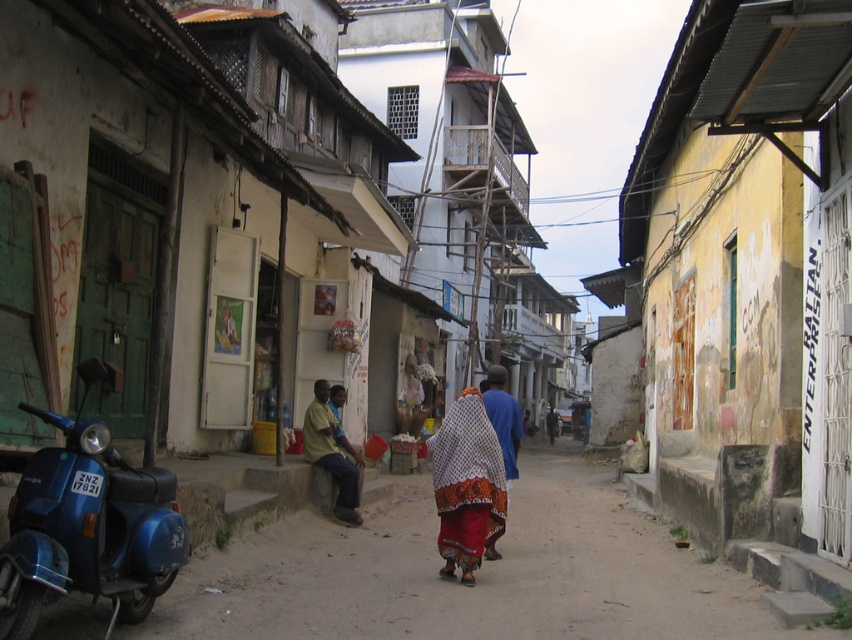
You are a delivery person trying to park your metallic blue scooter at left near the curb. However, there is a white printed fabric at center in the way. Can you park your scooter there without moving the fabric?

The metallic blue scooter at left is already positioned over the white printed fabric at center, so you cannot park there without moving the fabric.

You are a delivery person trying to park your metallic blue scooter at left near the curb. There is a white printed fabric at center hanging from a clothesline between two buildings. Can your scooter fit without touching the fabric?

The metallic blue scooter at left is larger than the white printed fabric at center, so it might not fit without touching the fabric. You should check the space carefully before parking.

You are standing on the narrow street and want to see both the white printed fabric at center and the orange printed fabric at center. Which one is closer to you?

The white printed fabric at center is closer to you because it is in front of the orange printed fabric at center.